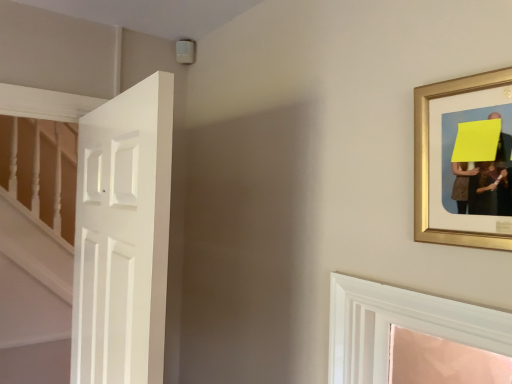
Question: Would you say white matte door at left is inside or outside gold framed picture at upper right?

Choices:
 (A) inside
 (B) outside

Answer: (B)

Question: From their relative heights in the image, would you say white matte door at left is taller or shorter than gold framed picture at upper right?

Choices:
 (A) tall
 (B) short

Answer: (A)

Question: From a real-world perspective, is white matte door at left physically located above or below gold framed picture at upper right?

Choices:
 (A) above
 (B) below

Answer: (B)

Question: Considering their positions, is gold framed picture at upper right located in front of or behind white matte door at left?

Choices:
 (A) behind
 (B) front

Answer: (B)

Question: From the image's perspective, is gold framed picture at upper right above or below white matte door at left?

Choices:
 (A) above
 (B) below

Answer: (A)

Question: From a real-world perspective, relative to white matte door at left, is gold framed picture at upper right vertically above or below?

Choices:
 (A) below
 (B) above

Answer: (B)

Question: Is point (499, 244) positioned closer to the camera than point (159, 167)?

Choices:
 (A) closer
 (B) farther

Answer: (A)